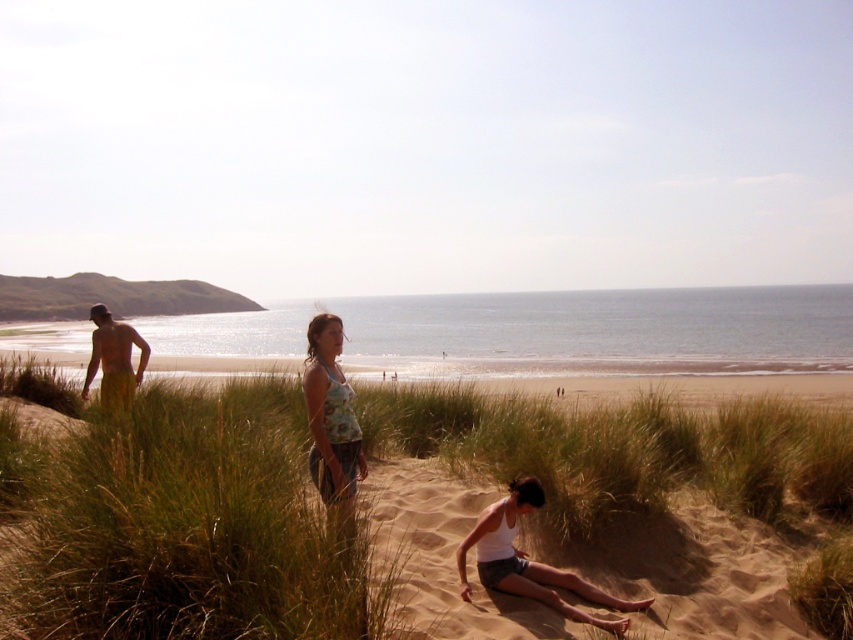
You are planning to set up a small tent for a picnic. The beige sand at center and the green grassy hill at upper left are both potential spots. Based on the scene description, which location offers a wider area for setting up the tent?

The beige sand at center offers a wider area for setting up the tent because its width surpasses that of the green grassy hill at upper left.

You are planning to build a small path between the green grassy hill at upper left and the yellow shorts at left. What is the minimum length of the path required to connect them?

The minimum length of the path required to connect the green grassy hill at upper left and the yellow shorts at left is 86.23 meters.